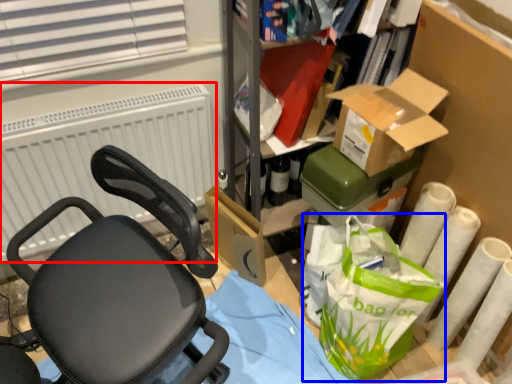
Question: Which object is further to the camera taking this photo, radiator (highlighted by a red box) or shopping bag (highlighted by a blue box)?

Choices:
 (A) radiator
 (B) shopping bag

Answer: (A)